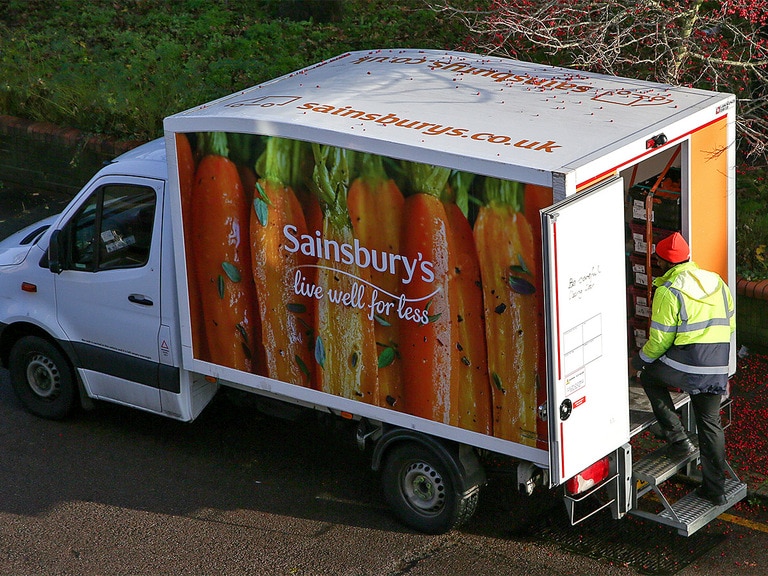
Locate an element on the screen. handle is located at coordinates (141, 303).